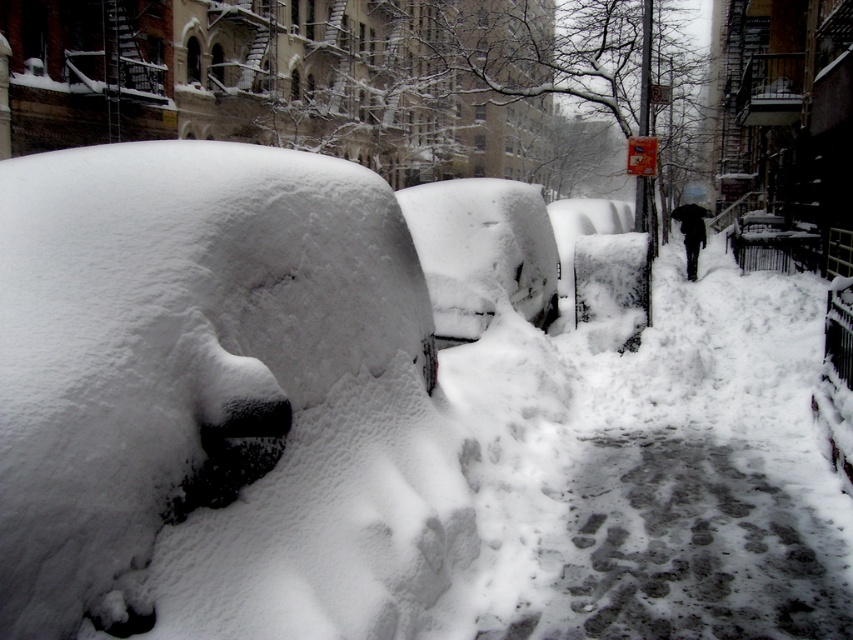
Question: Is gray/rough pavement at lower center positioned at the back of white fluffy snow at center?

Choices:
 (A) yes
 (B) no

Answer: (B)

Question: Which point is closer to the camera taking this photo?

Choices:
 (A) (489, 188)
 (B) (592, 468)

Answer: (B)

Question: Can you confirm if gray/rough pavement at lower center is bigger than white fluffy snow at center?

Choices:
 (A) yes
 (B) no

Answer: (B)

Question: Can you confirm if gray/rough pavement at lower center is positioned to the right of white fluffy snow at center?

Choices:
 (A) yes
 (B) no

Answer: (A)

Question: Among these objects, which one is nearest to the camera?

Choices:
 (A) white fluffy snow at center
 (B) gray/rough pavement at lower center

Answer: (B)

Question: Which of the following is the closest to the observer?

Choices:
 (A) white fluffy snow at center
 (B) gray/rough pavement at lower center

Answer: (B)